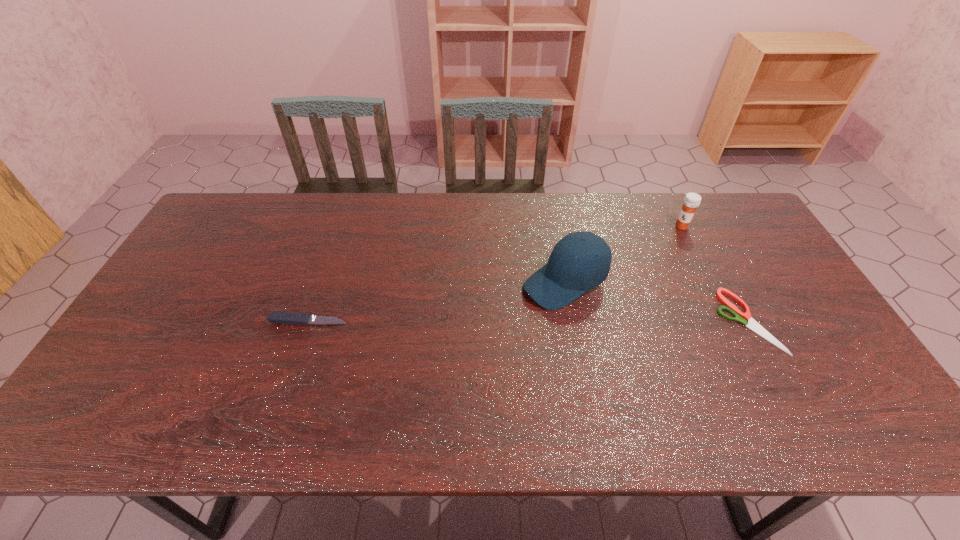
You are a GUI agent. You are given a task and a screenshot of the screen. Output one action in this format:
    pyautogui.click(x=<x>, y=<y>)
    Task: Click on the empty space that is in between the baseball cap and the shortest object
    The image size is (960, 540).
    Given the screenshot: What is the action you would take?
    pyautogui.click(x=656, y=301)

The width and height of the screenshot is (960, 540). Find the location of `vacant space that's between the tallest object and the steak knife`. vacant space that's between the tallest object and the steak knife is located at coordinates (437, 301).

Identify the location of vacant area that lies between the shortest object and the baseball cap. (656, 301).

Select which object is the third closest to the scissors. Please provide its 2D coordinates. Your answer should be formatted as a tuple, i.e. [(x, y)], where the tuple contains the x and y coordinates of a point satisfying the conditions above.

[(287, 318)]

At what (x,y) coordinates should I click in order to perform the action: click on the second closest object relative to the scissors. Please return your answer as a coordinate pair (x, y). This screenshot has height=540, width=960. Looking at the image, I should click on (580, 261).

Find the location of a particular element. Image resolution: width=960 pixels, height=540 pixels. vacant region that satisfies the following two spatial constraints: 1. on the front side of the scissors; 2. on the left side of the farthest object is located at coordinates (729, 321).